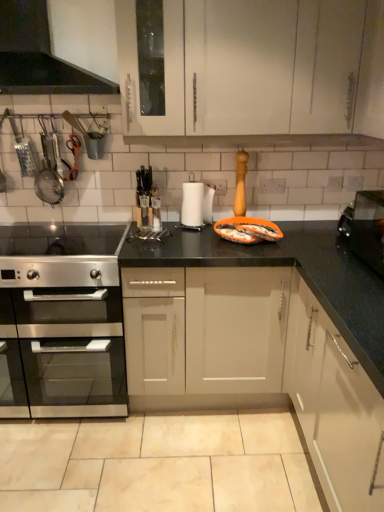
Question: Can you confirm if metallic strainer at left, the 2th appliance positioned from the right, is taller than orange plastic tray at center?

Choices:
 (A) yes
 (B) no

Answer: (A)

Question: Is metallic strainer at left, the 2th appliance positioned from the right, facing towards orange plastic tray at center?

Choices:
 (A) no
 (B) yes

Answer: (A)

Question: Is metallic strainer at left, acting as the 2th appliance starting from the front, far from orange plastic tray at center?

Choices:
 (A) no
 (B) yes

Answer: (B)

Question: From the image's perspective, is metallic strainer at left, the 1th appliance from the top, located beneath orange plastic tray at center?

Choices:
 (A) no
 (B) yes

Answer: (A)

Question: Considering the relative positions of metallic strainer at left, which appears as the 1th appliance when viewed from the left, and orange plastic tray at center in the image provided, is metallic strainer at left, which appears as the 1th appliance when viewed from the left, to the left of orange plastic tray at center from the viewer's perspective?

Choices:
 (A) no
 (B) yes

Answer: (B)

Question: From the image's perspective, is metallic strainer at left, the 2th appliance positioned from the right, positioned above or below satin silver gas stove at lower left?

Choices:
 (A) above
 (B) below

Answer: (A)

Question: Is point (46, 184) positioned closer to the camera than point (24, 250)?

Choices:
 (A) farther
 (B) closer

Answer: (B)

Question: Which is correct: metallic strainer at left, marked as the first appliance in a back-to-front arrangement, is inside satin silver gas stove at lower left, or outside of it?

Choices:
 (A) outside
 (B) inside

Answer: (A)

Question: Looking at the image, does metallic strainer at left, acting as the 2th appliance starting from the front, seem bigger or smaller compared to satin silver gas stove at lower left?

Choices:
 (A) small
 (B) big

Answer: (A)

Question: From the image's perspective, is metallic strainer at left, marked as the first appliance in a back-to-front arrangement, above or below beige matte granite at lower center?

Choices:
 (A) below
 (B) above

Answer: (B)

Question: Is metallic strainer at left, the 2th appliance positioned from the right, wider or thinner than beige matte granite at lower center?

Choices:
 (A) thin
 (B) wide

Answer: (A)

Question: In the image, is metallic strainer at left, the 1th appliance from the top, on the left side or the right side of beige matte granite at lower center?

Choices:
 (A) left
 (B) right

Answer: (A)

Question: In terms of height, does metallic strainer at left, which appears as the 1th appliance when viewed from the left, look taller or shorter compared to beige matte granite at lower center?

Choices:
 (A) short
 (B) tall

Answer: (B)

Question: Considering their positions, is stainless steel oven at left located in front of or behind beige matte granite at lower center?

Choices:
 (A) behind
 (B) front

Answer: (A)

Question: In terms of width, does stainless steel oven at left look wider or thinner when compared to beige matte granite at lower center?

Choices:
 (A) wide
 (B) thin

Answer: (B)